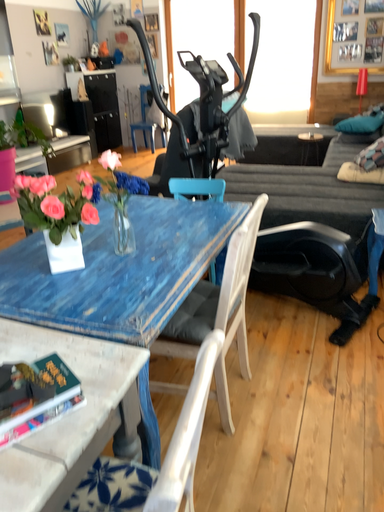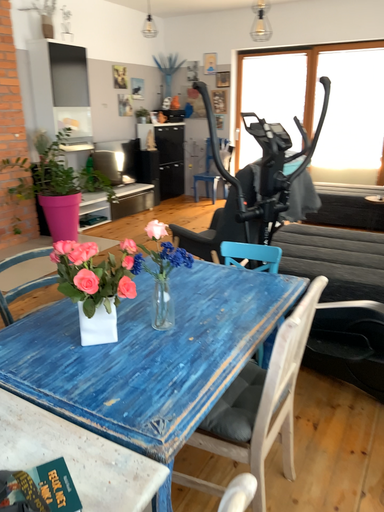
Question: Which way did the camera rotate in the video?

Choices:
 (A) rotated left
 (B) rotated right

Answer: (A)